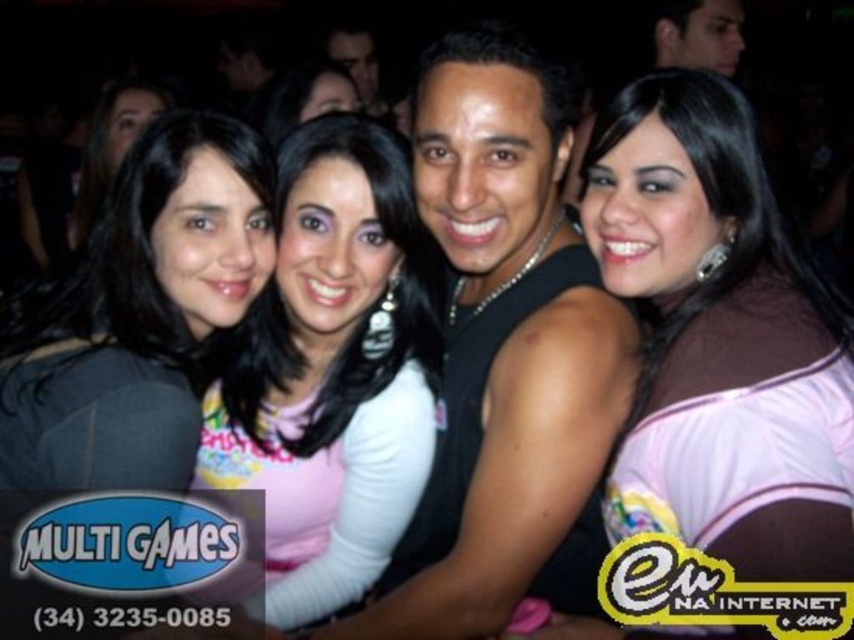
Is point (260, 236) behind point (98, 109)?

No, (260, 236) is closer to viewer.

You are a GUI agent. You are given a task and a screenshot of the screen. Output one action in this format:
    pyautogui.click(x=<x>, y=<y>)
    Task: Click on the matte black shirt at left
    
    Given the screenshot: What is the action you would take?
    pyautogui.click(x=138, y=314)

Who is taller, pink fabric shirt at center or matte black shirt at left?

With more height is pink fabric shirt at center.

The width and height of the screenshot is (854, 640). Find the location of `pink fabric shirt at center`. pink fabric shirt at center is located at coordinates (332, 371).

Where is `pink fabric shirt at center`? pink fabric shirt at center is located at coordinates (332, 371).

Is pink fabric shirt at center to the left of matte black hair at center from the viewer's perspective?

Incorrect, pink fabric shirt at center is not on the left side of matte black hair at center.

Who is lower down, pink fabric shirt at center or matte black hair at center?

pink fabric shirt at center is lower down.

Is point (335, 273) positioned after point (126, 140)?

No, (335, 273) is closer to viewer.

Locate an element on the screen. pink fabric shirt at center is located at coordinates (332, 371).